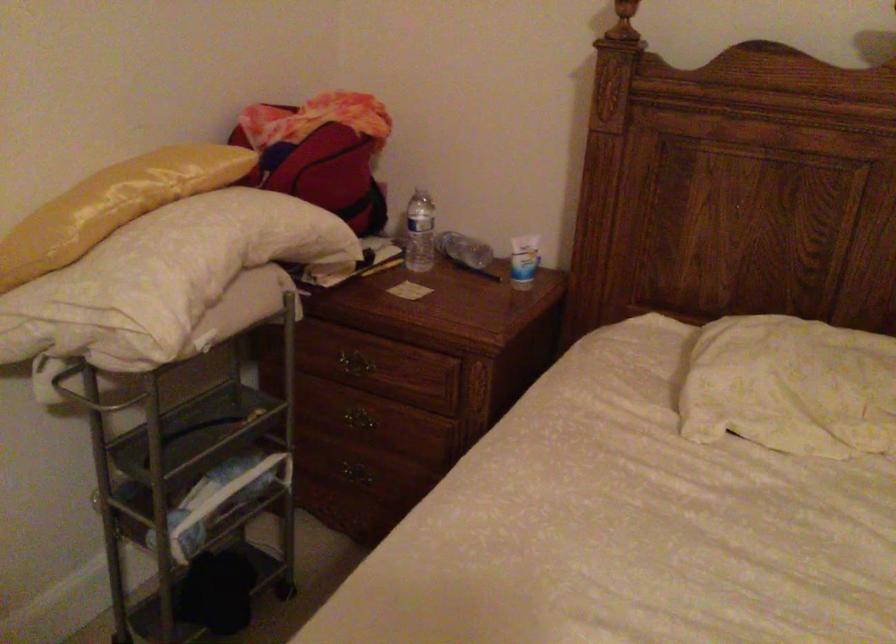
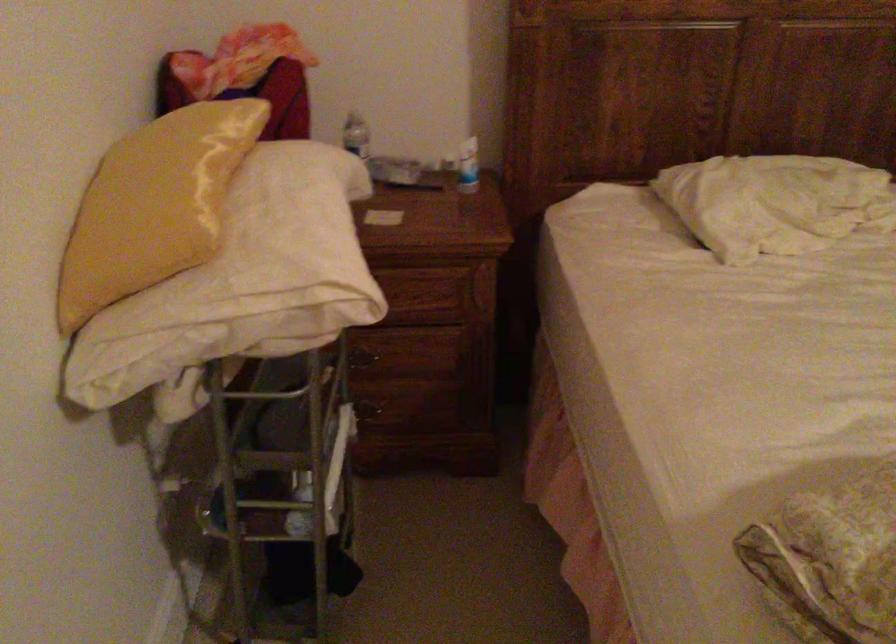
In the second image, find the point that corresponds to pixel 515 261 in the first image.

(468, 166)